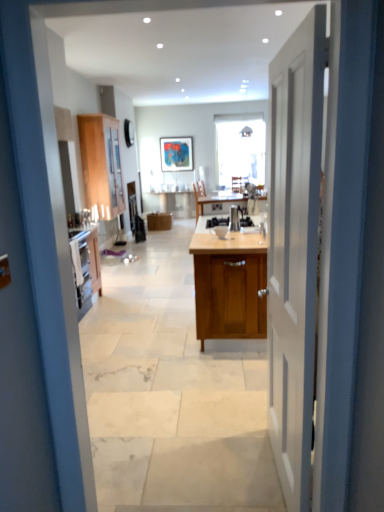
At what (x,y) coordinates should I click in order to perform the action: click on vacant region to the left of wooden cabinet at center, the 1th cabinetry in the right-to-left sequence. Please return your answer as a coordinate pair (x, y). The width and height of the screenshot is (384, 512). Looking at the image, I should click on (150, 306).